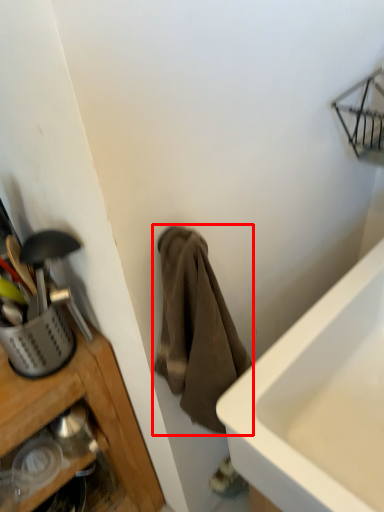
Question: From the image's perspective, where is towel/napkin (annotated by the red box) located relative to basket?

Choices:
 (A) above
 (B) below

Answer: (B)